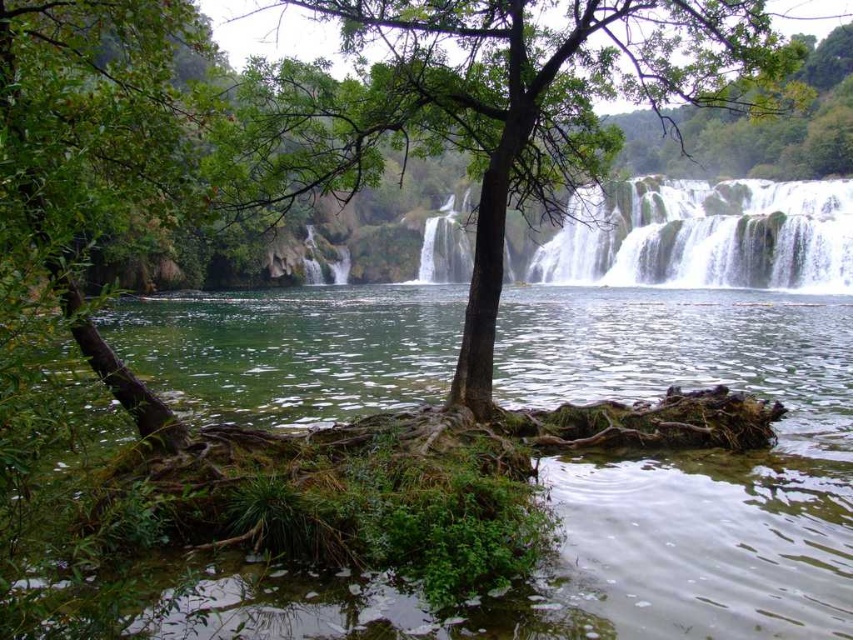
Between green leafy tree at center and white frothy water at center, which one appears on the right side from the viewer's perspective?

Positioned to the right is white frothy water at center.

Locate an element on the screen. This screenshot has width=853, height=640. green leafy tree at center is located at coordinates (496, 106).

Where is `green leafy tree at center`? green leafy tree at center is located at coordinates coord(496,106).

Is green mossy rock at center to the right of white frothy water at center from the viewer's perspective?

In fact, green mossy rock at center is to the left of white frothy water at center.

The width and height of the screenshot is (853, 640). I want to click on green mossy rock at center, so click(x=636, y=484).

Where is `green mossy rock at center`? This screenshot has height=640, width=853. green mossy rock at center is located at coordinates (636, 484).

Is green mossy rock at center to the right of green leafy tree at center from the viewer's perspective?

No, green mossy rock at center is not to the right of green leafy tree at center.

Who is more forward, (x=431, y=358) or (x=480, y=209)?

Positioned in front is point (x=480, y=209).

Find the location of `green mossy rock at center`. green mossy rock at center is located at coordinates (636, 484).